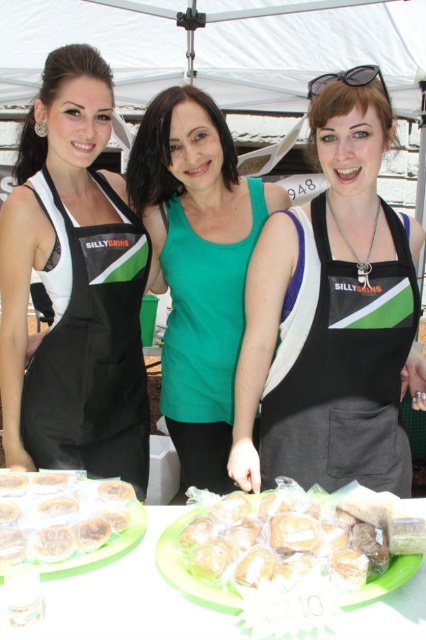
You are a customer at a food event and you want to pick up the golden brown pastry at center. The black matte apron at left is in your way. Can you reach the pastry without moving the apron?

The black matte apron at left is 1.01 meters away from the golden brown pastry at center, so you can reach the pastry without moving the apron since the distance is sufficient.

You are standing at the point with coordinates point (406, 579) and want to walk to the point with coordinates point (106, 426). Are you able to walk directly to your destination without moving around any obstacles?

Point (106, 426) is behind point (406, 579), so you cannot walk directly to your destination without moving around the obstacle at point (406, 579).